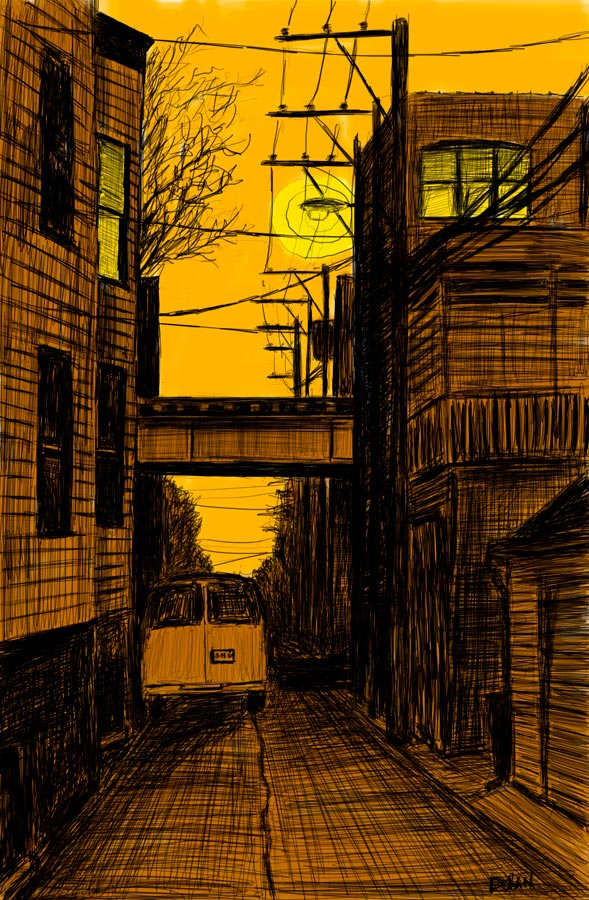
You are a GUI agent. You are given a task and a screenshot of the screen. Output one action in this format:
    pyautogui.click(x=<x>, y=<y>)
    Task: Click on the windows with lights on
    The height and width of the screenshot is (900, 589).
    Given the screenshot: What is the action you would take?
    pyautogui.click(x=107, y=171), pyautogui.click(x=479, y=158)